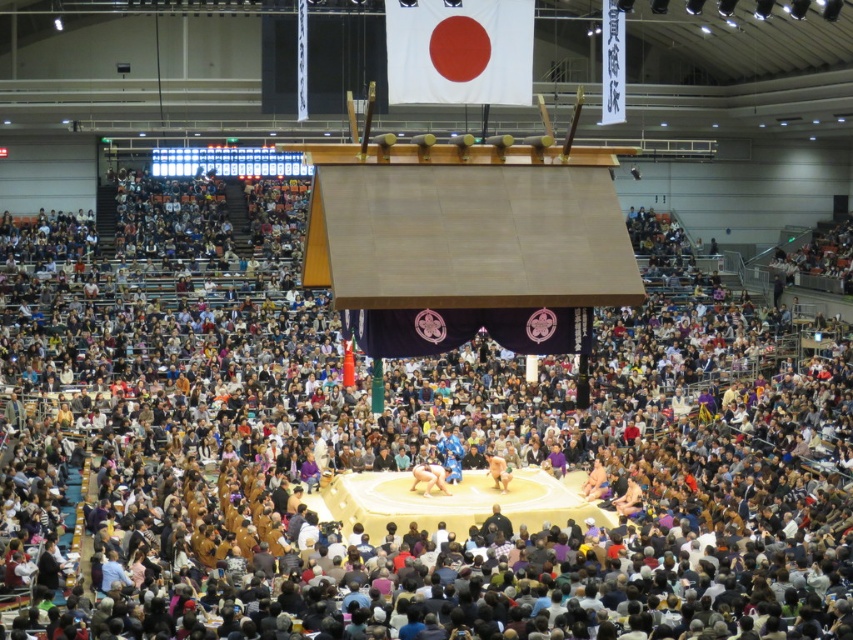
You are a photographer standing at the back of the arena and want to take a photo of the smooth beige sumo wrestler at center and the white fabric flag at upper center in the same frame. Given that your camera has a maximum zoom range of 100 meters, can you capture both objects in the same shot?

The distance between the white fabric flag at upper center and the smooth beige sumo wrestler at center is 28.63 meters. Since your camera can zoom up to 100 meters, which is greater than the distance between them, you can capture both objects in the same frame.

You are a photographer standing at the edge of the dohyo trying to capture the white fabric flag at upper center. If you look straight ahead, will the flag be in your line of sight? Please answer based on its coordinates.

The white fabric flag at upper center is positioned at coordinates point (459, 51), which places it directly in front of you. Therefore, looking straight ahead would allow you to see the flag in your line of sight.

You are a photographer positioned at the back of the arena. You want to take a photo of the smooth beige sumo wrestler at center without the white fabric flag at upper center appearing in the frame. Which direction should you adjust your camera to avoid capturing the flag?

To avoid capturing the white fabric flag at upper center, you should adjust your camera to the right side since the flag is positioned to the left of the smooth beige sumo wrestler at center.